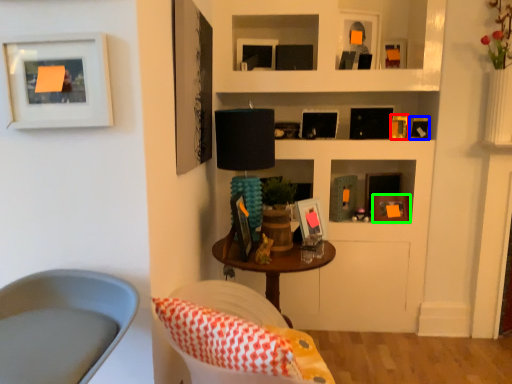
Question: Based on their relative distances, which object is nearer to picture frame (highlighted by a red box)? Choose from picture frame (highlighted by a blue box) and picture frame (highlighted by a green box).

Choices:
 (A) picture frame
 (B) picture frame

Answer: (A)